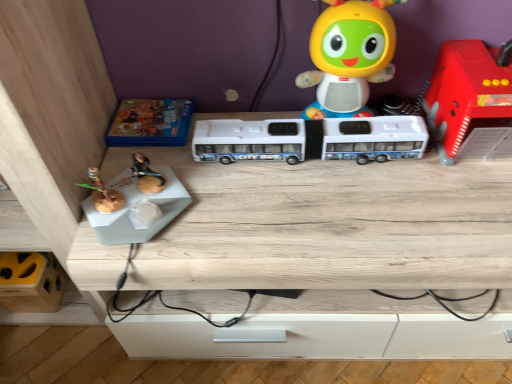
Question: Would you say wooden table at center is inside or outside white plastic bus at center, the 3th toy positioned from the left?

Choices:
 (A) inside
 (B) outside

Answer: (B)

Question: Based on their sizes in the image, would you say wooden table at center is bigger or smaller than white plastic bus at center, the 3th toy positioned from the left?

Choices:
 (A) small
 (B) big

Answer: (B)

Question: Which object is positioned farthest from the matte plastic toy at upper center, arranged as the 2th toy when viewed from the right?

Choices:
 (A) blue cardboard box at upper left, the second toy in the left-to-right sequence
 (B) wooden table at center
 (C) yellow matte toy at lower left, the 5th toy in the right-to-left sequence
 (D) white plastic bus at center, the 3th toy positioned from the left
 (E) rubberized red fire truck at right, which is the 1th toy in right-to-left order

Answer: (C)

Question: Estimate the real-world distances between objects in this image. Which object is closer to the yellow matte toy at lower left, the 5th toy in the right-to-left sequence?

Choices:
 (A) blue cardboard box at upper left, the second toy in the left-to-right sequence
 (B) white plastic bus at center, acting as the third toy starting from the right
 (C) rubberized red fire truck at right, which is the 1th toy in right-to-left order
 (D) matte plastic toy at upper center, arranged as the 2th toy when viewed from the right
 (E) wooden table at center

Answer: (A)